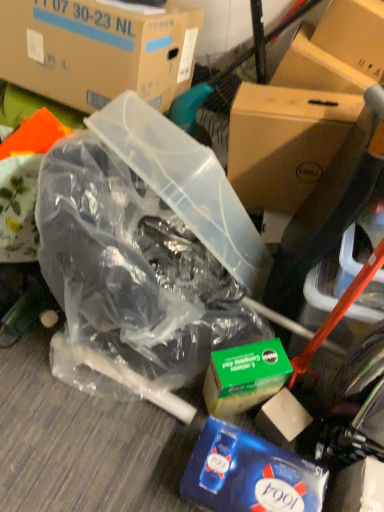
Find the location of a particular element. green cardboard box at center is located at coordinates (244, 377).

This screenshot has height=512, width=384. Describe the element at coordinates (249, 474) in the screenshot. I see `blue glossy tissue box at lower right` at that location.

This screenshot has width=384, height=512. Find the location of `brown cardboard box at upper right, positioned as the 2th box in left-to-right order`. brown cardboard box at upper right, positioned as the 2th box in left-to-right order is located at coordinates (284, 142).

Does cardboard box at upper left, marked as the second box in a right-to-left arrangement, have a smaller size compared to green cardboard box at center?

Incorrect, cardboard box at upper left, marked as the second box in a right-to-left arrangement, is not smaller in size than green cardboard box at center.

Between cardboard box at upper left, which is the first box in left-to-right order, and green cardboard box at center, which one is positioned in front?

green cardboard box at center is more forward.

From the image's perspective, which one is positioned higher, cardboard box at upper left, which is the first box in left-to-right order, or green cardboard box at center?

cardboard box at upper left, which is the first box in left-to-right order, appears higher in the image.

From a real-world perspective, is cardboard box at upper left, which is the first box in left-to-right order, positioned under transparent plastic bag at center based on gravity?

Actually, cardboard box at upper left, which is the first box in left-to-right order, is physically above transparent plastic bag at center in the real world.

Considering the relative sizes of cardboard box at upper left, marked as the second box in a right-to-left arrangement, and transparent plastic bag at center in the image provided, is cardboard box at upper left, marked as the second box in a right-to-left arrangement, thinner than transparent plastic bag at center?

Indeed, cardboard box at upper left, marked as the second box in a right-to-left arrangement, has a lesser width compared to transparent plastic bag at center.

Identify the location of the 1st box behind when counting from the transparent plastic bag at center. (98, 50).

Is cardboard box at upper left, marked as the second box in a right-to-left arrangement, aimed at transparent plastic bag at center?

No.

From a real-world perspective, is blue glossy tissue box at lower right physically below cardboard box at upper left, which is the first box in left-to-right order?

Yes, from a real-world perspective, blue glossy tissue box at lower right is beneath cardboard box at upper left, which is the first box in left-to-right order.

Is blue glossy tissue box at lower right not within cardboard box at upper left, marked as the second box in a right-to-left arrangement?

blue glossy tissue box at lower right lies outside cardboard box at upper left, marked as the second box in a right-to-left arrangement,'s area.

Is the surface of blue glossy tissue box at lower right in direct contact with cardboard box at upper left, marked as the second box in a right-to-left arrangement?

No, blue glossy tissue box at lower right is not in contact with cardboard box at upper left, marked as the second box in a right-to-left arrangement.

Considering the relative sizes of blue glossy tissue box at lower right and cardboard box at upper left, marked as the second box in a right-to-left arrangement, in the image provided, is blue glossy tissue box at lower right shorter than cardboard box at upper left, marked as the second box in a right-to-left arrangement,?

Correct, blue glossy tissue box at lower right is not as tall as cardboard box at upper left, marked as the second box in a right-to-left arrangement.

Is blue glossy tissue box at lower right in front of or behind brown cardboard box at upper right, the first box positioned from the right, in the image?

blue glossy tissue box at lower right is in front of brown cardboard box at upper right, the first box positioned from the right.

From the picture: Is blue glossy tissue box at lower right bigger or smaller than brown cardboard box at upper right, positioned as the 2th box in left-to-right order?

blue glossy tissue box at lower right is smaller than brown cardboard box at upper right, positioned as the 2th box in left-to-right order.

Can we say blue glossy tissue box at lower right lies outside brown cardboard box at upper right, the first box positioned from the right?

blue glossy tissue box at lower right lies outside brown cardboard box at upper right, the first box positioned from the right,'s area.

Considering the relative positions of blue glossy tissue box at lower right and brown cardboard box at upper right, positioned as the 2th box in left-to-right order, in the image provided, is blue glossy tissue box at lower right to the left or to the right of brown cardboard box at upper right, positioned as the 2th box in left-to-right order,?

Based on their positions, blue glossy tissue box at lower right is located to the left of brown cardboard box at upper right, positioned as the 2th box in left-to-right order.

From the image's perspective, is brown cardboard box at upper right, the first box positioned from the right, below green cardboard box at center?

No, from the image's perspective, brown cardboard box at upper right, the first box positioned from the right, is not beneath green cardboard box at center.

Considering the relative sizes of brown cardboard box at upper right, positioned as the 2th box in left-to-right order, and green cardboard box at center in the image provided, is brown cardboard box at upper right, positioned as the 2th box in left-to-right order, thinner than green cardboard box at center?

No.

Starting from the green cardboard box at center, which box is the 2nd one behind? Please provide its 2D coordinates.

[(284, 142)]

Considering the sizes of objects brown cardboard box at upper right, positioned as the 2th box in left-to-right order, and green cardboard box at center in the image provided, who is shorter, brown cardboard box at upper right, positioned as the 2th box in left-to-right order, or green cardboard box at center?

green cardboard box at center is shorter.

Between transparent plastic bag at center and blue glossy tissue box at lower right, which one has larger width?

Wider between the two is transparent plastic bag at center.

Is transparent plastic bag at center taller than blue glossy tissue box at lower right?

Yes, transparent plastic bag at center is taller than blue glossy tissue box at lower right.

From the image's perspective, which object appears higher, transparent plastic bag at center or blue glossy tissue box at lower right?

transparent plastic bag at center appears higher in the image.

Which object is further away from the camera, transparent plastic bag at center or blue glossy tissue box at lower right?

Answer: blue glossy tissue box at lower right is further away from the camera.

Is brown cardboard box at upper right, the first box positioned from the right, inside or outside of transparent plastic bag at center?

brown cardboard box at upper right, the first box positioned from the right, is located beyond the bounds of transparent plastic bag at center.

Starting from the transparent plastic bag at center, which box is the 2nd one behind? Please provide its 2D coordinates.

[(284, 142)]

Are brown cardboard box at upper right, the first box positioned from the right, and transparent plastic bag at center far apart?

No, brown cardboard box at upper right, the first box positioned from the right, is not far away from transparent plastic bag at center.

From the image's perspective, is brown cardboard box at upper right, the first box positioned from the right, under transparent plastic bag at center?

Incorrect, from the image's perspective, brown cardboard box at upper right, the first box positioned from the right, is higher than transparent plastic bag at center.

Find the location of a particular element. product on the right of cardboard box at upper left, marked as the second box in a right-to-left arrangement is located at coordinates (244, 377).

Where is `plastic bag below the cardboard box at upper left, marked as the second box in a right-to-left arrangement (from a real-world perspective)`? plastic bag below the cardboard box at upper left, marked as the second box in a right-to-left arrangement (from a real-world perspective) is located at coordinates (143, 249).

Looking at the image, which one is located closer to transparent plastic bag at center, green cardboard box at center or blue glossy tissue box at lower right?

The object closer to transparent plastic bag at center is green cardboard box at center.

Estimate the real-world distances between objects in this image. Which object is further from green cardboard box at center, brown cardboard box at upper right, positioned as the 2th box in left-to-right order, or blue glossy tissue box at lower right?

brown cardboard box at upper right, positioned as the 2th box in left-to-right order, is positioned further to the anchor green cardboard box at center.

Based on their spatial positions, is transparent plastic bag at center or cardboard box at upper left, marked as the second box in a right-to-left arrangement, closer to blue glossy tissue box at lower right?

transparent plastic bag at center is closer to blue glossy tissue box at lower right.

From the image, which object appears to be nearer to blue glossy tissue box at lower right, transparent plastic bag at center or green cardboard box at center?

green cardboard box at center is positioned closer to the anchor blue glossy tissue box at lower right.

Estimate the real-world distances between objects in this image. Which object is further from blue glossy tissue box at lower right, green cardboard box at center or transparent plastic bag at center?

transparent plastic bag at center lies further to blue glossy tissue box at lower right than the other object.

Considering their positions, is brown cardboard box at upper right, positioned as the 2th box in left-to-right order, positioned closer to transparent plastic bag at center than blue glossy tissue box at lower right?

Based on the image, brown cardboard box at upper right, positioned as the 2th box in left-to-right order, appears to be nearer to transparent plastic bag at center.

Looking at the image, which one is located closer to cardboard box at upper left, which is the first box in left-to-right order, brown cardboard box at upper right, positioned as the 2th box in left-to-right order, or transparent plastic bag at center?

Among the two, transparent plastic bag at center is located nearer to cardboard box at upper left, which is the first box in left-to-right order.

When comparing their distances from blue glossy tissue box at lower right, does cardboard box at upper left, marked as the second box in a right-to-left arrangement, or brown cardboard box at upper right, the first box positioned from the right, seem further?

cardboard box at upper left, marked as the second box in a right-to-left arrangement.

Where is `product between cardboard box at upper left, marked as the second box in a right-to-left arrangement, and blue glossy tissue box at lower right in the up-down direction`? Image resolution: width=384 pixels, height=512 pixels. product between cardboard box at upper left, marked as the second box in a right-to-left arrangement, and blue glossy tissue box at lower right in the up-down direction is located at coordinates (244, 377).

Where is `product between brown cardboard box at upper right, the first box positioned from the right, and blue glossy tissue box at lower right in the up-down direction`? The image size is (384, 512). product between brown cardboard box at upper right, the first box positioned from the right, and blue glossy tissue box at lower right in the up-down direction is located at coordinates (244, 377).

The width and height of the screenshot is (384, 512). I want to click on product between transparent plastic bag at center and blue glossy tissue box at lower right in the vertical direction, so click(x=244, y=377).

Locate an element on the screen. The image size is (384, 512). plastic bag that lies between brown cardboard box at upper right, the first box positioned from the right, and green cardboard box at center from top to bottom is located at coordinates (143, 249).